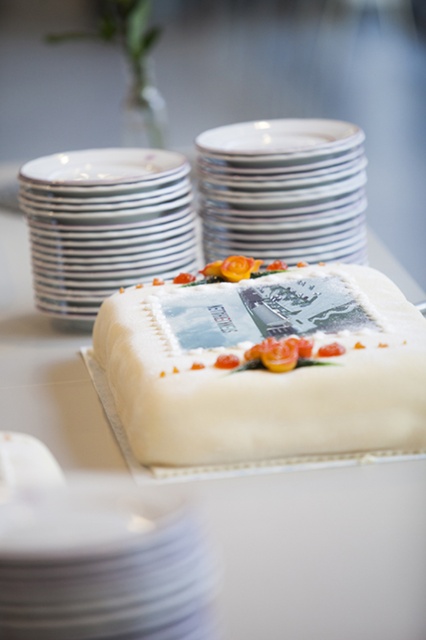
Question: Which of these objects is positioned farthest from the white smooth cake at center?

Choices:
 (A) white ceramic plates at upper left
 (B) white glossy stack at upper center

Answer: (B)

Question: Is white smooth cake at center to the right of white ceramic plates at upper left from the viewer's perspective?

Choices:
 (A) no
 (B) yes

Answer: (B)

Question: Is white ceramic platter at center further to the viewer compared to white glossy stack at upper center?

Choices:
 (A) no
 (B) yes

Answer: (A)

Question: In this image, where is white smooth cake at center located relative to white glossy stack at upper center?

Choices:
 (A) left
 (B) right

Answer: (A)

Question: Which of the following is the farthest from the observer?

Choices:
 (A) (25, 272)
 (B) (293, 225)

Answer: (A)

Question: Among these points, which one is nearest to the camera?

Choices:
 (A) (66, 502)
 (B) (313, 609)

Answer: (A)